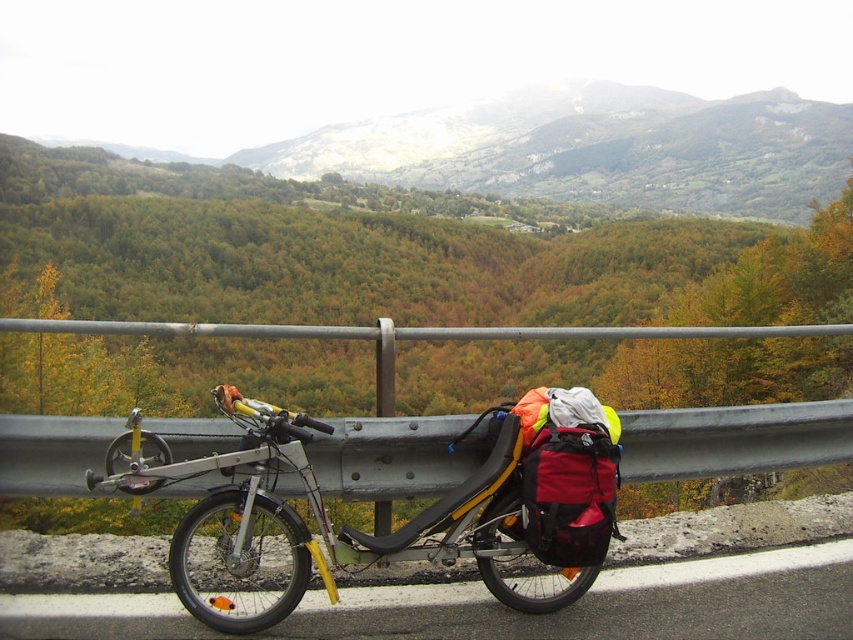
Question: Which point is farther to the camera?

Choices:
 (A) (671, 452)
 (B) (288, 636)
 (C) (265, 404)

Answer: (A)

Question: Which point is closer to the camera?

Choices:
 (A) (363, 593)
 (B) (434, 476)
 (C) (370, 540)

Answer: (C)

Question: Does silver metallic bicycle at center appear on the left side of metallic gray guardrail at center?

Choices:
 (A) no
 (B) yes

Answer: (A)

Question: Which is nearer to the black rubber bicycle at lower center?

Choices:
 (A) metallic gray guardrail at center
 (B) silver metallic bicycle at center

Answer: (B)

Question: Observing the image, what is the correct spatial positioning of silver metallic bicycle at center in reference to metallic gray guardrail at center?

Choices:
 (A) left
 (B) right

Answer: (B)

Question: Does silver metallic bicycle at center appear on the right side of metallic gray guardrail at center?

Choices:
 (A) yes
 (B) no

Answer: (A)